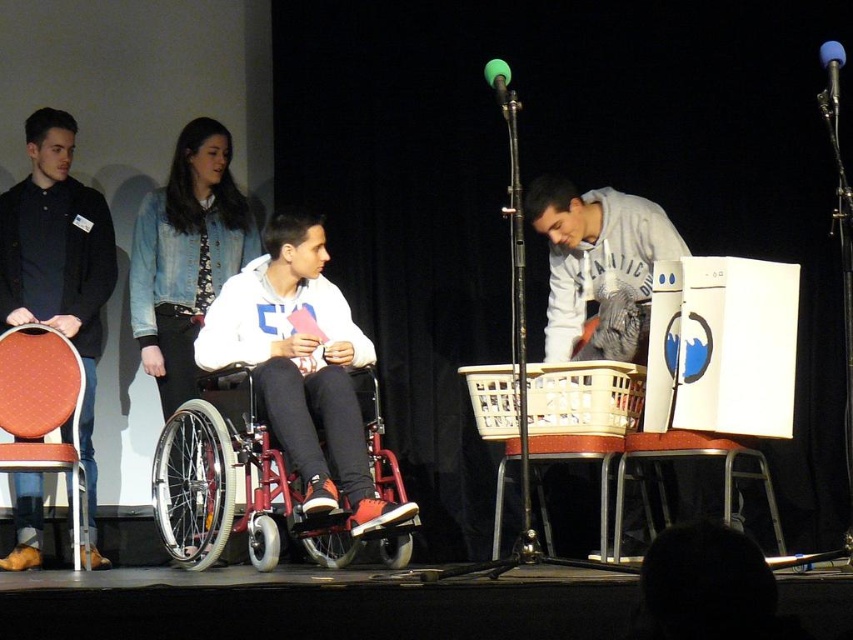
Question: Which point is closer to the camera?

Choices:
 (A) (103, 289)
 (B) (845, 58)
 (C) (38, 435)

Answer: (C)

Question: Which object is closer to the camera taking this photo?

Choices:
 (A) green matte microphone at upper center
 (B) blue foam microphone at upper right

Answer: (B)

Question: Which of the following is the closest to the observer?

Choices:
 (A) (825, 92)
 (B) (36, 369)

Answer: (A)

Question: Can you confirm if red fabric chair at left is positioned above green matte microphone at upper center?

Choices:
 (A) yes
 (B) no

Answer: (B)

Question: Considering the relative positions of denim jacket at upper left and blue foam microphone at upper right in the image provided, where is denim jacket at upper left located with respect to blue foam microphone at upper right?

Choices:
 (A) above
 (B) below

Answer: (B)

Question: Does white matte wheelchair at center appear under metallic red wheelchair at center?

Choices:
 (A) no
 (B) yes

Answer: (A)